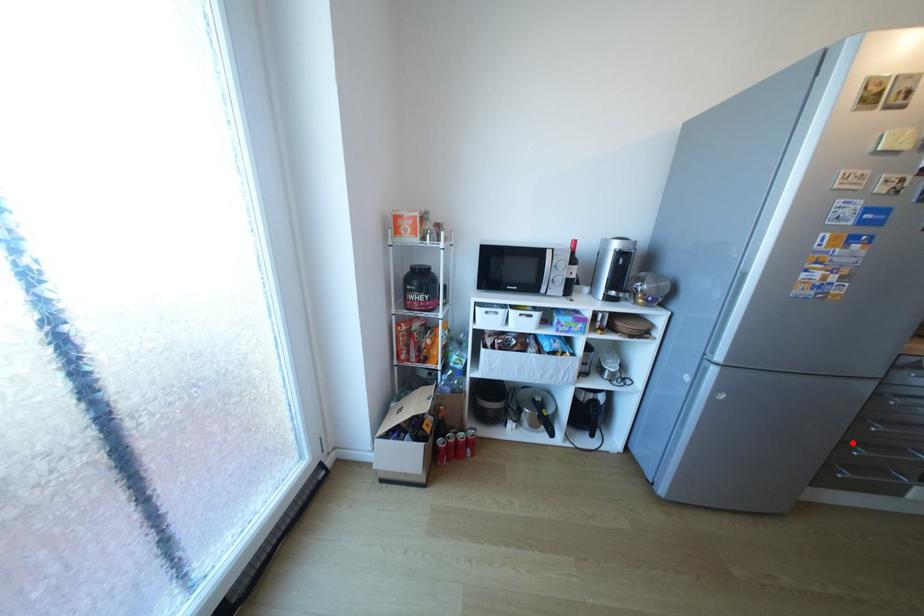
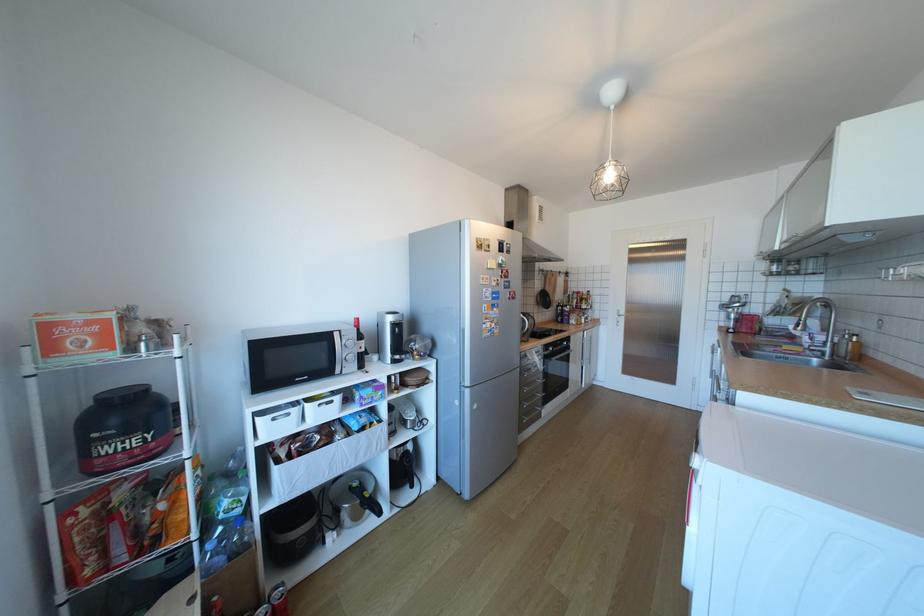
Question: I am providing you with two images of the same scene from different viewpoints. A red point is shown in image1. For the corresponding object point in image2, is it positioned nearer or farther from the camera?

Choices:
 (A) Nearer
 (B) Farther

Answer: (B)